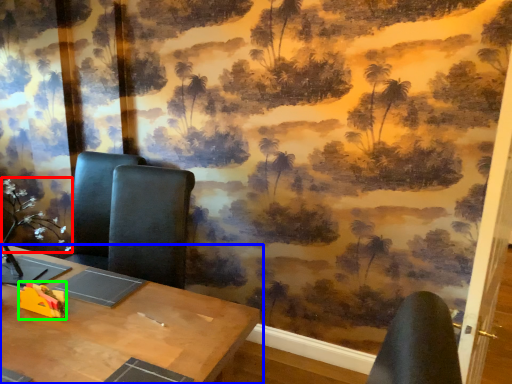
Question: Which object is positioned closest to flower (highlighted by a red box)? Select from table (highlighted by a blue box) and toy (highlighted by a green box).

Choices:
 (A) table
 (B) toy

Answer: (B)